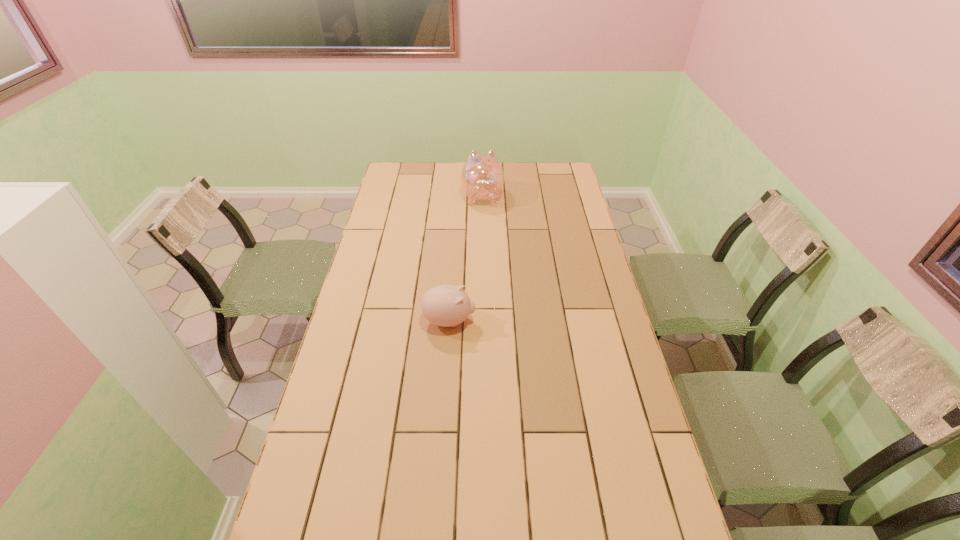
Locate an element on the screen. Image resolution: width=960 pixels, height=540 pixels. the taller piggy bank is located at coordinates (482, 177).

The width and height of the screenshot is (960, 540). I want to click on the farther object, so click(x=482, y=177).

Locate an element on the screen. The height and width of the screenshot is (540, 960). the nearer piggy bank is located at coordinates (445, 305).

Locate an element on the screen. The width and height of the screenshot is (960, 540). the shorter object is located at coordinates [445, 305].

Locate an element on the screen. vacant space situated 0.180m on the front facing side of the farther object is located at coordinates (482, 165).

Where is `free space located 0.120m on the front facing side of the farther object`? free space located 0.120m on the front facing side of the farther object is located at coordinates (482, 171).

The image size is (960, 540). Identify the location of free point located on the front facing side of the farther object. (482, 165).

I want to click on free region located 0.160m at the snout of the shorter piggy bank, so click(523, 321).

Find the location of `object present at the far edge`. object present at the far edge is located at coordinates (482, 177).

Find the location of a particular element. vacant space at the far edge of the desktop is located at coordinates (528, 167).